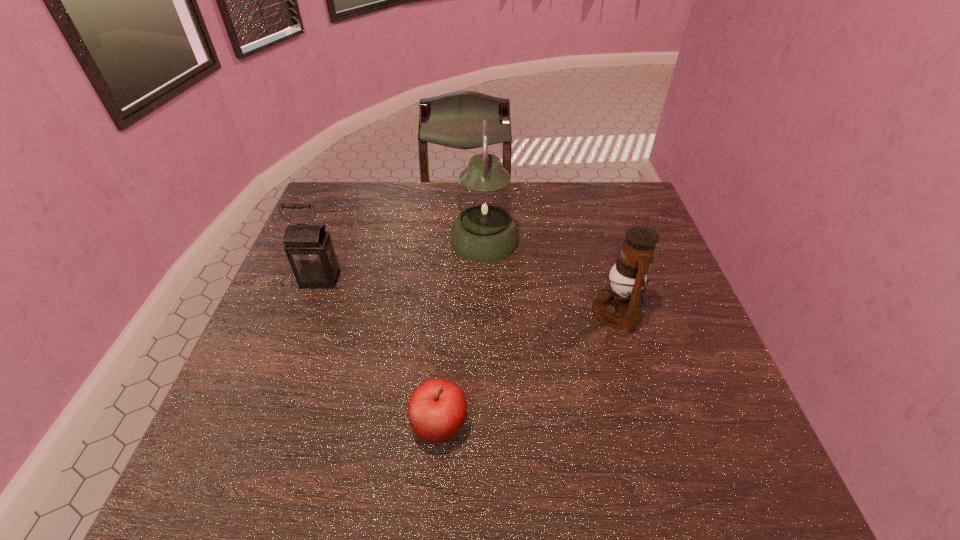
Identify the location of free space located on the side of the rightmost lantern, there is a wick adjustment knob. Image resolution: width=960 pixels, height=540 pixels. (492, 310).

Locate an element on the screen. The image size is (960, 540). vacant space located on the side of the rightmost lantern, there is a wick adjustment knob is located at coordinates (552, 310).

The height and width of the screenshot is (540, 960). Find the location of `vacant region located on the front-facing side of the leftmost lantern`. vacant region located on the front-facing side of the leftmost lantern is located at coordinates (283, 380).

Identify the location of vacant space located 0.340m on the left of the shortest object. (240, 426).

I want to click on object located in the far edge section of the desktop, so click(484, 231).

Where is `object that is at the near edge`? The height and width of the screenshot is (540, 960). object that is at the near edge is located at coordinates (437, 408).

Where is `object present at the left edge`? The width and height of the screenshot is (960, 540). object present at the left edge is located at coordinates [x=309, y=249].

What are the coordinates of `object located at the right edge` in the screenshot? It's located at (619, 306).

I want to click on vacant position at the far edge of the desktop, so click(x=527, y=184).

Where is `vacant point at the near edge`? vacant point at the near edge is located at coordinates (575, 491).